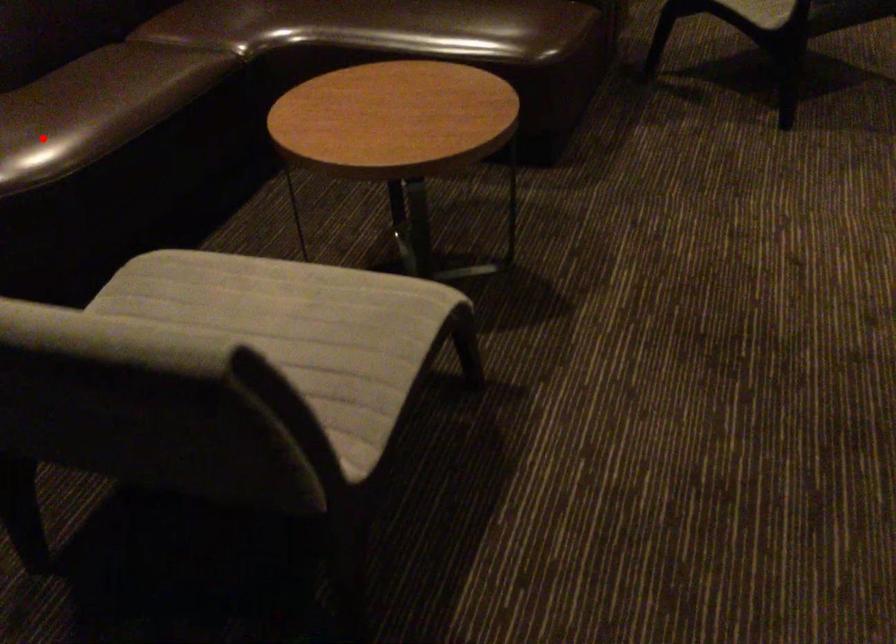
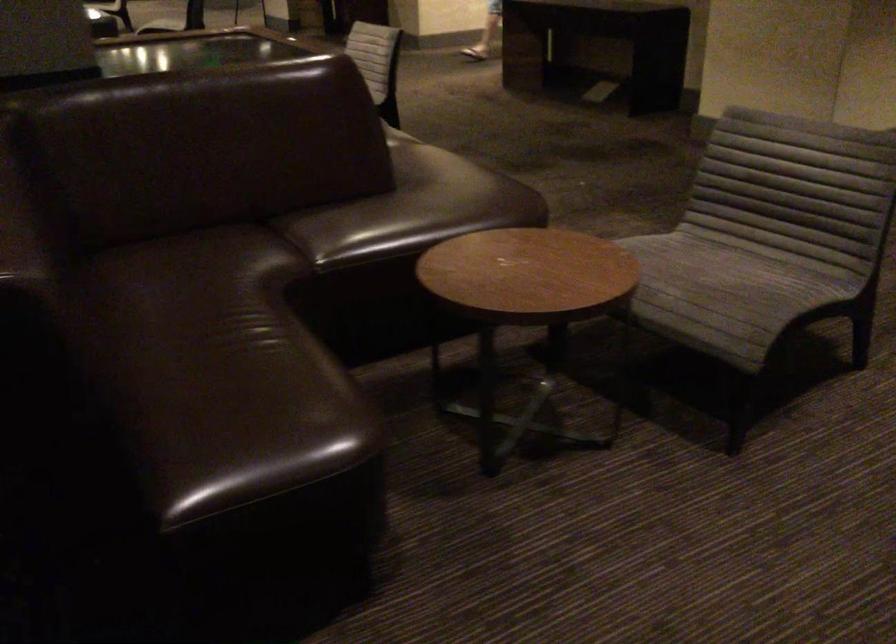
Question: I am providing you with two images of the same scene from different viewpoints. A red point is marked on the first image. Is the red point's position out of view in image 2?

Choices:
 (A) Yes
 (B) No

Answer: (A)